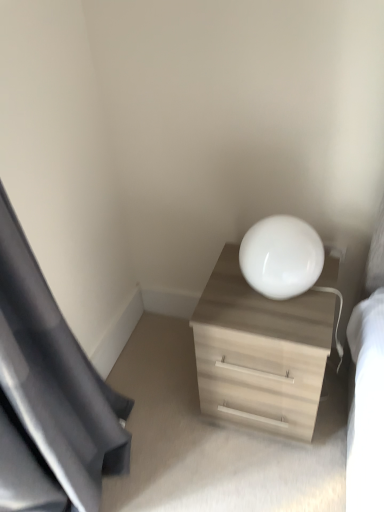
This screenshot has height=512, width=384. I want to click on vacant space positioned to the left of white glossy lampshade at upper right, so click(221, 297).